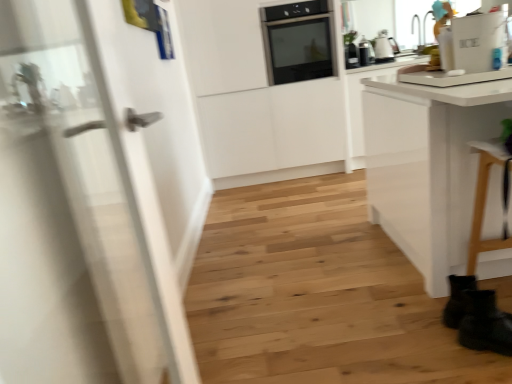
Question: Should I look upward or downward to see black matte boot at lower right?

Choices:
 (A) down
 (B) up

Answer: (A)

Question: From the image's perspective, is black glossy toaster at upper right, positioned as the second kitchen appliance in right-to-left order, located beneath black matte boot at lower right?

Choices:
 (A) yes
 (B) no

Answer: (B)

Question: Is the position of black glossy toaster at upper right, marked as the 1th kitchen appliance in a left-to-right arrangement, more distant than that of black matte boot at lower right?

Choices:
 (A) yes
 (B) no

Answer: (A)

Question: Considering the relative positions of black glossy toaster at upper right, positioned as the second kitchen appliance in right-to-left order, and black matte boot at lower right in the image provided, is black glossy toaster at upper right, positioned as the second kitchen appliance in right-to-left order, in front of black matte boot at lower right?

Choices:
 (A) no
 (B) yes

Answer: (A)

Question: Does black glossy toaster at upper right, positioned as the second kitchen appliance in right-to-left order, have a greater width compared to black matte boot at lower right?

Choices:
 (A) no
 (B) yes

Answer: (A)

Question: Can you confirm if black glossy toaster at upper right, marked as the 1th kitchen appliance in a left-to-right arrangement, is positioned to the right of black matte boot at lower right?

Choices:
 (A) yes
 (B) no

Answer: (B)

Question: From the image's perspective, would you say black glossy toaster at upper right, marked as the 1th kitchen appliance in a left-to-right arrangement, is positioned over black matte boot at lower right?

Choices:
 (A) no
 (B) yes

Answer: (B)

Question: From the image's perspective, is white glossy refrigerator at upper right on top of white glossy door at left?

Choices:
 (A) yes
 (B) no

Answer: (A)

Question: Can you confirm if white glossy refrigerator at upper right is smaller than white glossy door at left?

Choices:
 (A) yes
 (B) no

Answer: (A)

Question: Is white glossy refrigerator at upper right looking in the opposite direction of white glossy door at left?

Choices:
 (A) yes
 (B) no

Answer: (B)

Question: Considering the relative sizes of white glossy refrigerator at upper right and white glossy door at left in the image provided, is white glossy refrigerator at upper right bigger than white glossy door at left?

Choices:
 (A) no
 (B) yes

Answer: (A)

Question: Can you confirm if white glossy refrigerator at upper right is positioned to the right of white glossy door at left?

Choices:
 (A) no
 (B) yes

Answer: (B)

Question: Does white glossy refrigerator at upper right have a lesser width compared to white glossy door at left?

Choices:
 (A) no
 (B) yes

Answer: (B)

Question: Does matte silver kettle at upper right, which appears as the 1th kitchen appliance when viewed from the right, lie in front of white glossy door at left?

Choices:
 (A) yes
 (B) no

Answer: (B)